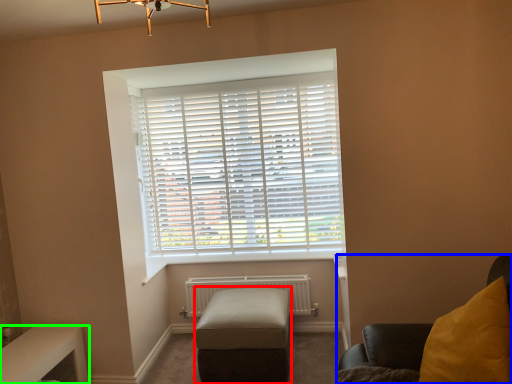
Question: Based on their relative distances, which object is farther from stool (highlighted by a red box)? Choose from furniture (highlighted by a blue box) and table (highlighted by a green box).

Choices:
 (A) furniture
 (B) table

Answer: (B)